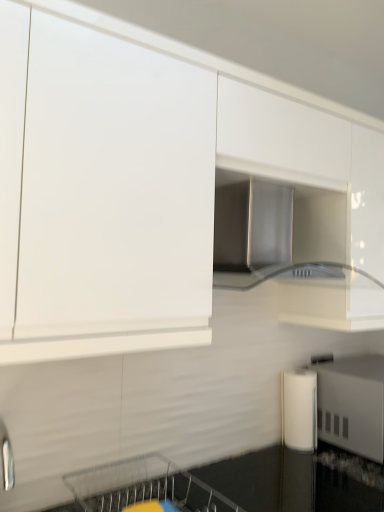
Question: Considering the relative positions of white glossy cabinet at upper center and white glossy paper towel dispenser at lower right, the first appliance positioned from the right, in the image provided, is white glossy cabinet at upper center to the left of white glossy paper towel dispenser at lower right, the first appliance positioned from the right, from the viewer's perspective?

Choices:
 (A) yes
 (B) no

Answer: (A)

Question: From a real-world perspective, does white glossy cabinet at upper center stand above white glossy paper towel dispenser at lower right, the first appliance positioned from the right?

Choices:
 (A) yes
 (B) no

Answer: (A)

Question: Is white glossy cabinet at upper center shorter than white glossy paper towel dispenser at lower right, the first appliance positioned from the right?

Choices:
 (A) yes
 (B) no

Answer: (B)

Question: Does white glossy cabinet at upper center have a lesser width compared to white glossy paper towel dispenser at lower right, placed as the 2th appliance when sorted from left to right?

Choices:
 (A) no
 (B) yes

Answer: (A)

Question: Is white glossy cabinet at upper center behind white glossy paper towel dispenser at lower right, placed as the 2th appliance when sorted from left to right?

Choices:
 (A) no
 (B) yes

Answer: (A)

Question: Is white glossy cabinet at upper center far from white glossy paper towel dispenser at lower right, placed as the 2th appliance when sorted from left to right?

Choices:
 (A) yes
 (B) no

Answer: (B)

Question: Is stainless steel range hood at center wider than metallic silver dishwasher at lower center?

Choices:
 (A) yes
 (B) no

Answer: (B)

Question: Can you confirm if stainless steel range hood at center is bigger than metallic silver dishwasher at lower center?

Choices:
 (A) no
 (B) yes

Answer: (B)

Question: From a real-world perspective, is stainless steel range hood at center physically above metallic silver dishwasher at lower center?

Choices:
 (A) yes
 (B) no

Answer: (A)

Question: Is stainless steel range hood at center smaller than metallic silver dishwasher at lower center?

Choices:
 (A) no
 (B) yes

Answer: (A)

Question: From the image's perspective, does stainless steel range hood at center appear lower than metallic silver dishwasher at lower center?

Choices:
 (A) yes
 (B) no

Answer: (B)

Question: Is stainless steel range hood at center further to the viewer compared to metallic silver dishwasher at lower center?

Choices:
 (A) no
 (B) yes

Answer: (B)

Question: Considering the relative sizes of metallic silver dishwasher at lower center and stainless steel range hood at center in the image provided, is metallic silver dishwasher at lower center smaller than stainless steel range hood at center?

Choices:
 (A) no
 (B) yes

Answer: (B)